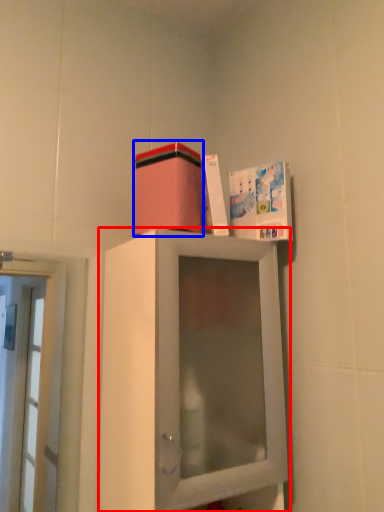
Question: Among these objects, which one is farthest to the camera, cabinetry (highlighted by a red box) or cardboard box (highlighted by a blue box)?

Choices:
 (A) cabinetry
 (B) cardboard box

Answer: (B)